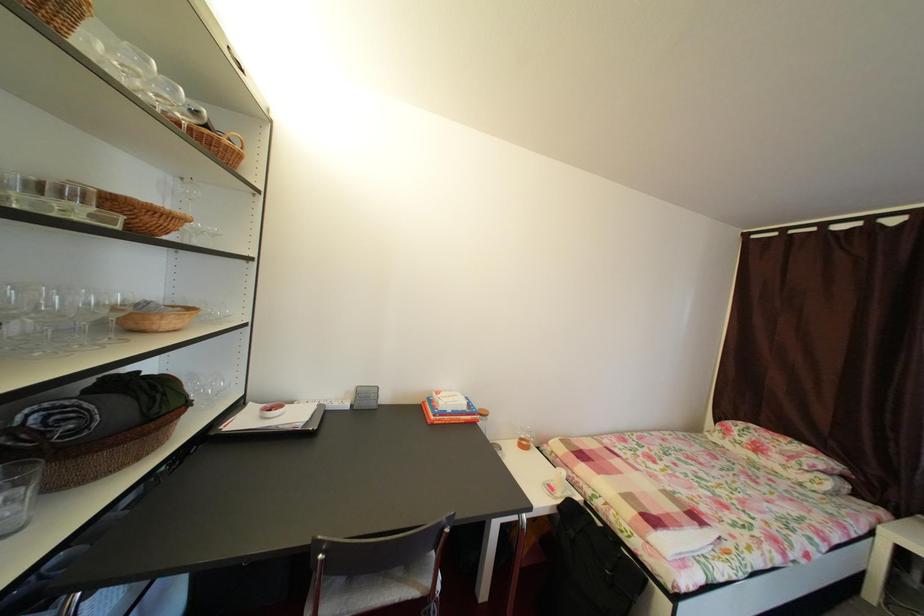
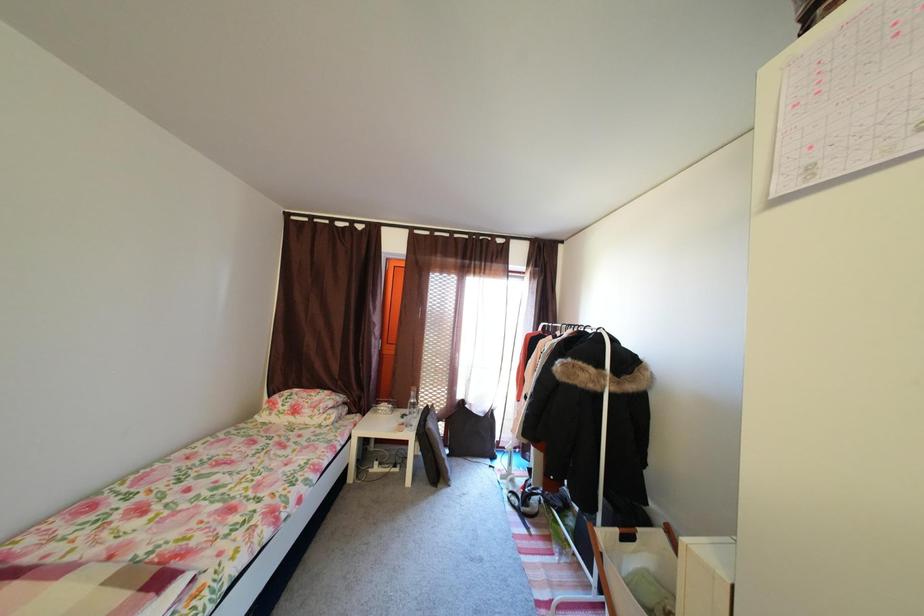
Question: The camera is either moving clockwise (left) or counter-clockwise (right) around the object. The first image is from the beginning of the video and the second image is from the end. Is the camera moving left or right when shooting the video?

Choices:
 (A) Left
 (B) Right

Answer: (A)